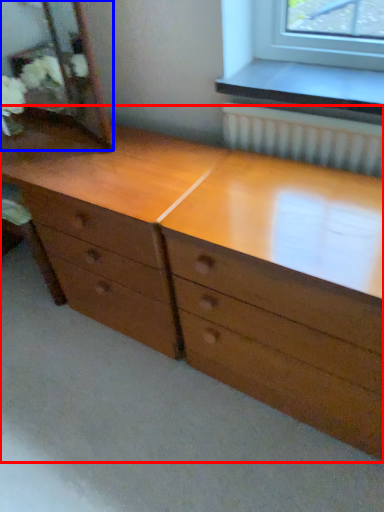
Question: Among these objects, which one is nearest to the camera, chest of drawers (highlighted by a red box) or mirror (highlighted by a blue box)?

Choices:
 (A) chest of drawers
 (B) mirror

Answer: (A)